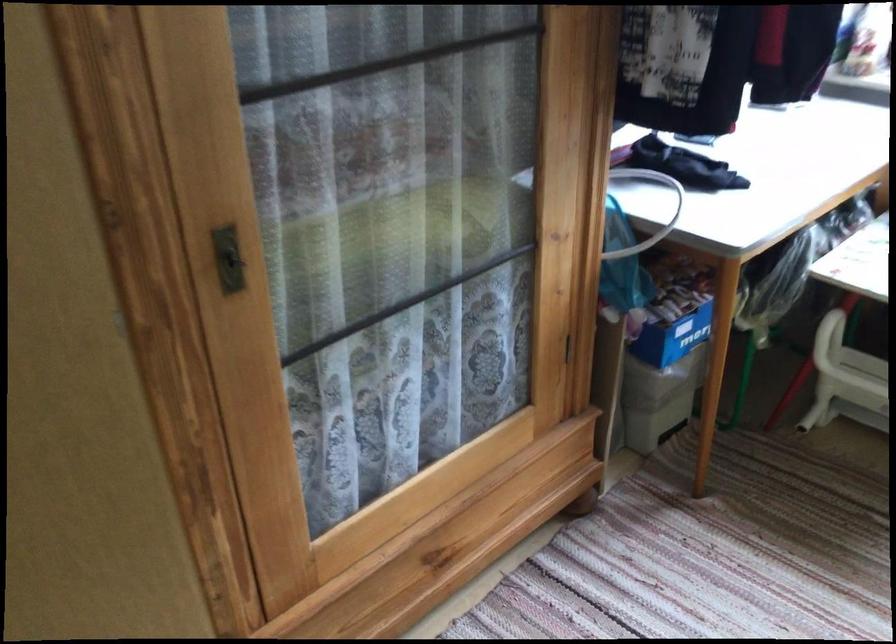
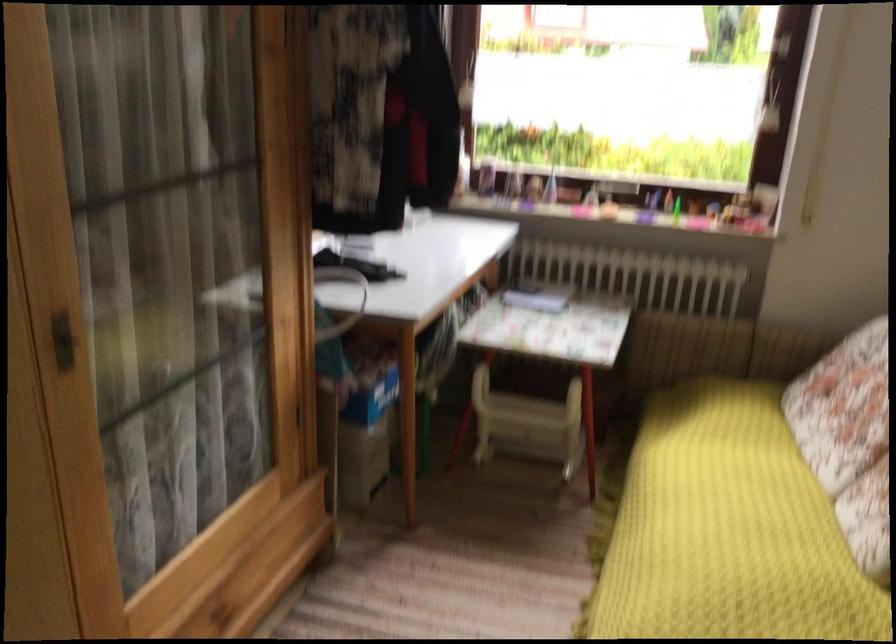
Find the pixel in the second image that matches point (657, 313) in the first image.

(360, 381)